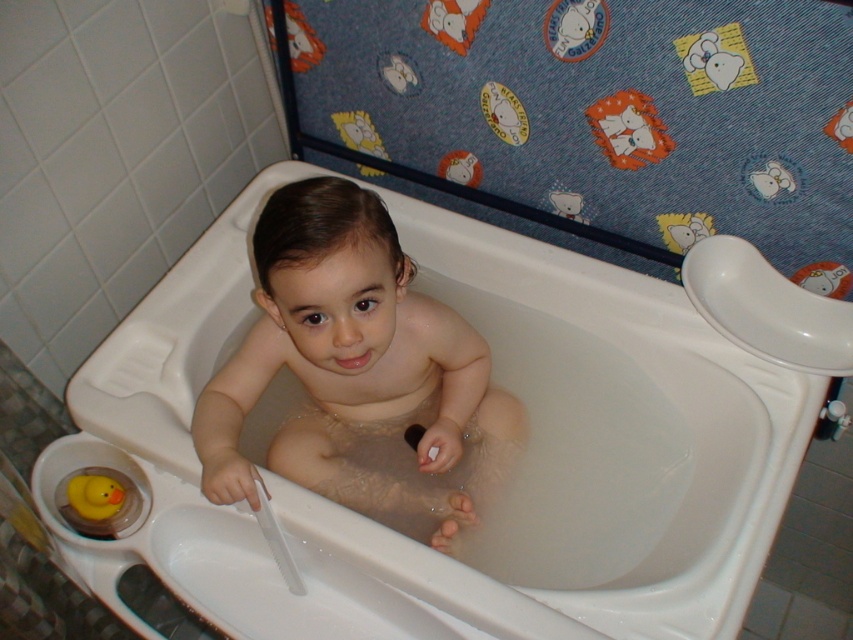
Question: Which of the following is the farthest from the observer?

Choices:
 (A) (91, 499)
 (B) (779, 403)

Answer: (B)

Question: Does white plastic bathtub at center have a greater width compared to smooth skin baby at center?

Choices:
 (A) yes
 (B) no

Answer: (A)

Question: Can you confirm if white plastic bathtub at center is wider than rubber duck at lower left?

Choices:
 (A) no
 (B) yes

Answer: (B)

Question: Considering the real-world distances, which object is closest to the rubber duck at lower left?

Choices:
 (A) white plastic bathtub at center
 (B) smooth skin baby at center

Answer: (B)

Question: Is white plastic bathtub at center below rubber duck at lower left?

Choices:
 (A) yes
 (B) no

Answer: (B)

Question: Which of these objects is positioned closest to the smooth skin baby at center?

Choices:
 (A) rubber duck at lower left
 (B) white plastic bathtub at center

Answer: (B)